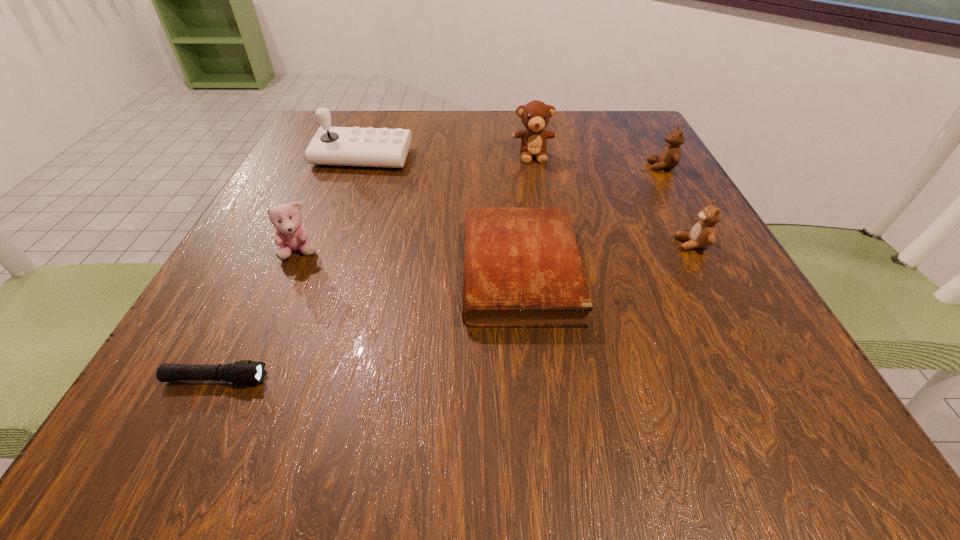
At what (x,y) coordinates should I click in order to perform the action: click on object at the far right corner. Please return your answer as a coordinate pair (x, y). Looking at the image, I should click on (670, 156).

Where is `free space at the far edge`? Image resolution: width=960 pixels, height=540 pixels. free space at the far edge is located at coordinates (388, 116).

You are a GUI agent. You are given a task and a screenshot of the screen. Output one action in this format:
    pyautogui.click(x=<x>, y=<y>)
    Task: Click on the free space at the left edge
    The image size is (960, 540).
    Given the screenshot: What is the action you would take?
    pyautogui.click(x=333, y=247)

Identify the location of free space at the right edge of the desktop. The image size is (960, 540). (651, 223).

Find the location of `vacant area at the far left corner`. vacant area at the far left corner is located at coordinates (355, 111).

Find the location of a particular element. The width and height of the screenshot is (960, 540). free region at the near left corner of the desktop is located at coordinates (159, 435).

The image size is (960, 540). I want to click on vacant space that's between the joystick and the tallest teddy bear, so click(447, 156).

Find the location of a particular element. Image resolution: width=960 pixels, height=540 pixels. empty space that is in between the leftmost teddy bear and the flashlight is located at coordinates (258, 316).

Where is `vacant area that lies between the tallest teddy bear and the leftmost teddy bear`? The image size is (960, 540). vacant area that lies between the tallest teddy bear and the leftmost teddy bear is located at coordinates (417, 204).

Locate an element on the screen. The height and width of the screenshot is (540, 960). vacant space that is in between the shortest object and the joystick is located at coordinates (289, 268).